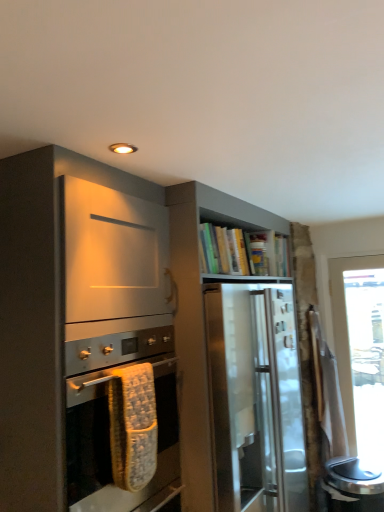
Where is `matte silver oven at center`? This screenshot has width=384, height=512. matte silver oven at center is located at coordinates (116, 417).

The height and width of the screenshot is (512, 384). What do you see at coordinates (116, 417) in the screenshot?
I see `matte silver oven at center` at bounding box center [116, 417].

You are a GUI agent. You are given a task and a screenshot of the screen. Output one action in this format:
    pyautogui.click(x=<x>, y=<y>)
    Task: Click on the satin wood cabinet at upper center
    
    Given the screenshot: What is the action you would take?
    pyautogui.click(x=235, y=357)

Describe the element at coordinates (235, 357) in the screenshot. This screenshot has width=384, height=512. I see `satin wood cabinet at upper center` at that location.

Measure the distance between point [265,380] and camera.

The distance of point [265,380] from camera is 6.57 feet.

The image size is (384, 512). What are the coordinates of `matte silver oven at center` in the screenshot? It's located at (116, 417).

Which object is positioned more to the right, matte silver oven at center or satin wood cabinet at upper center?

satin wood cabinet at upper center.

Is the depth of matte silver oven at center greater than that of satin wood cabinet at upper center?

No, matte silver oven at center is in front of satin wood cabinet at upper center.

Which is behind, point (92, 495) or point (219, 444)?

Point (219, 444)

From the image's perspective, is matte silver oven at center above or below satin wood cabinet at upper center?

From the image's perspective, matte silver oven at center appears above satin wood cabinet at upper center.

From a real-world perspective, is matte silver oven at center physically above satin wood cabinet at upper center?

Yes, from a real-world perspective, matte silver oven at center is over satin wood cabinet at upper center

Considering the sizes of objects matte silver oven at center and satin wood cabinet at upper center in the image provided, who is thinner, matte silver oven at center or satin wood cabinet at upper center?

Thinner between the two is matte silver oven at center.

Considering the sizes of objects matte silver oven at center and satin wood cabinet at upper center in the image provided, who is taller, matte silver oven at center or satin wood cabinet at upper center?

satin wood cabinet at upper center is taller.

Based on their sizes in the image, would you say matte silver oven at center is bigger or smaller than satin wood cabinet at upper center?

In the image, matte silver oven at center appears to be smaller than satin wood cabinet at upper center.

Is matte silver oven at center outside of satin wood cabinet at upper center?

Yes, matte silver oven at center is outside of satin wood cabinet at upper center.

Are matte silver oven at center and satin wood cabinet at upper center beside each other?

No, matte silver oven at center is not with satin wood cabinet at upper center.

Is matte silver oven at center facing away from satin wood cabinet at upper center?

No, matte silver oven at center is not facing away from satin wood cabinet at upper center.

The image size is (384, 512). I want to click on oven above the satin wood cabinet at upper center (from the image's perspective), so click(116, 417).

Is satin wood cabinet at upper center at the right side of matte silver oven at center?

Yes, satin wood cabinet at upper center is to the right of matte silver oven at center.

Which is behind, satin wood cabinet at upper center or matte silver oven at center?

satin wood cabinet at upper center is more distant.

Considering the positions of point (213, 206) and point (108, 496), is point (213, 206) closer or farther from the camera than point (108, 496)?

Point (213, 206) is farther from the camera than point (108, 496).

From the image's perspective, which is below, satin wood cabinet at upper center or matte silver oven at center?

satin wood cabinet at upper center.

From a real-world perspective, is satin wood cabinet at upper center located beneath matte silver oven at center?

Yes, from a real-world perspective, satin wood cabinet at upper center is under matte silver oven at center.

Looking at their sizes, would you say satin wood cabinet at upper center is wider or thinner than matte silver oven at center?

Clearly, satin wood cabinet at upper center has more width compared to matte silver oven at center.

Between satin wood cabinet at upper center and matte silver oven at center, which one has more height?

satin wood cabinet at upper center is taller.

Between satin wood cabinet at upper center and matte silver oven at center, which one has smaller size?

With smaller size is matte silver oven at center.

Does satin wood cabinet at upper center contain matte silver oven at center?

Definitely not — matte silver oven at center is not inside satin wood cabinet at upper center.

Is satin wood cabinet at upper center far away from matte silver oven at center?

No, satin wood cabinet at upper center is not far away from matte silver oven at center.

Is satin wood cabinet at upper center oriented towards matte silver oven at center?

No.

How many degrees apart are the facing directions of satin wood cabinet at upper center and matte silver oven at center?

They differ by 1.57 degrees in their facing directions.

I want to click on oven that is in front of the satin wood cabinet at upper center, so click(x=116, y=417).

I want to click on oven to the left of satin wood cabinet at upper center, so click(116, 417).

The image size is (384, 512). Find the location of `cabinetry below the matte silver oven at center (from the image's perspective)`. cabinetry below the matte silver oven at center (from the image's perspective) is located at coordinates (235, 357).